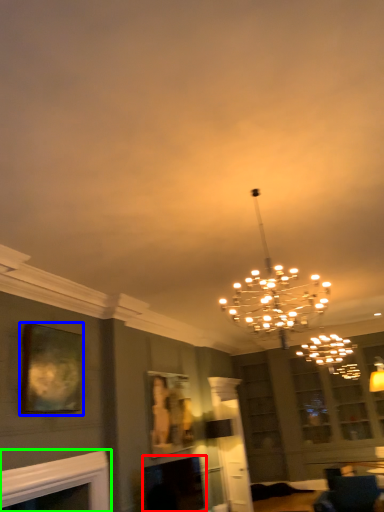
Question: Which object is the closest to the fireplace (highlighted by a red box)? Choose among these: picture frame (highlighted by a blue box) or fireplace (highlighted by a green box).

Choices:
 (A) picture frame
 (B) fireplace

Answer: (B)